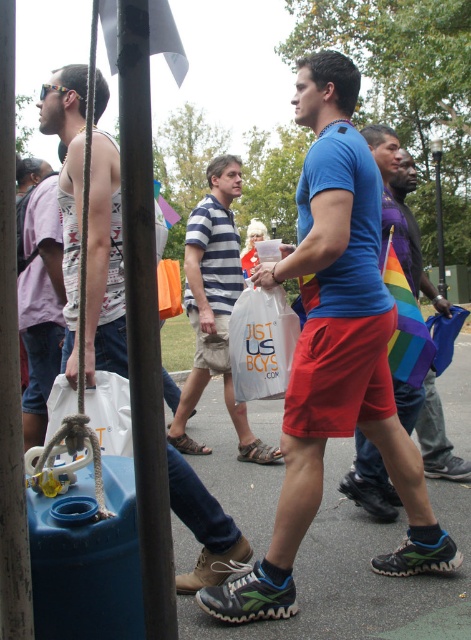
What is the 2D coordinate of the metallic pole at left in the image?

The metallic pole at left is located at the 2D coordinate point of (144, 320).